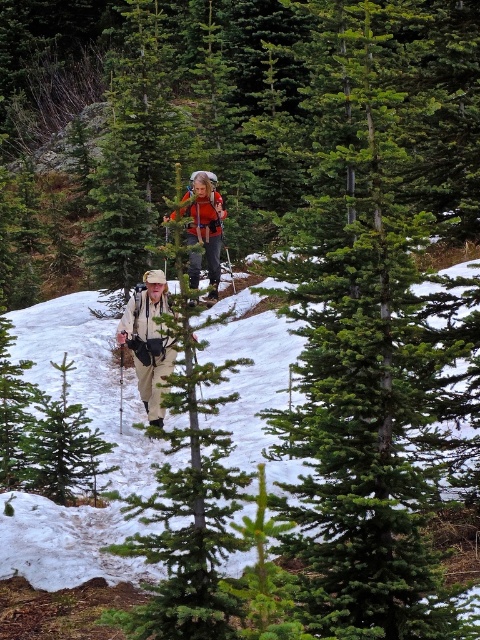
You are planning to take a photo of the green evergreen tree at center from the position of the hikers in the foreground. Based on their current location, will the tree be fully visible in your frame without any obstructions?

The green evergreen tree at center is located at point (359, 356), which means it is positioned centrally in the image. Since the hikers are in the foreground and the tree is at the center, it should be fully visible without obstructions from their position.

You are a hiker who wants to retrieve an item from your backpack without disturbing the other hiker. Which backpack should you reach for, the khaki fabric backpack at center or the orange fabric backpack at center?

You should reach for the khaki fabric backpack at center because it is positioned under the orange fabric backpack at center, making it more accessible without disturbing the other hiker.

You are a hiker who wants to know the position of the khaki fabric backpack at center and orange fabric backpack at center. Which backpack is positioned to the left?

The khaki fabric backpack at center is to the left of the orange fabric backpack at center.